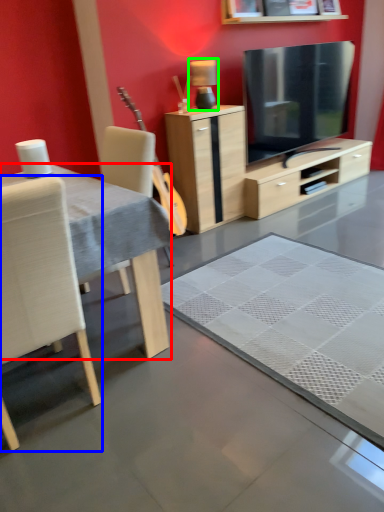
Question: Based on their relative distances, which object is farther from desk (highlighted by a red box)? Choose from chair (highlighted by a blue box) and lamp (highlighted by a green box).

Choices:
 (A) chair
 (B) lamp

Answer: (B)